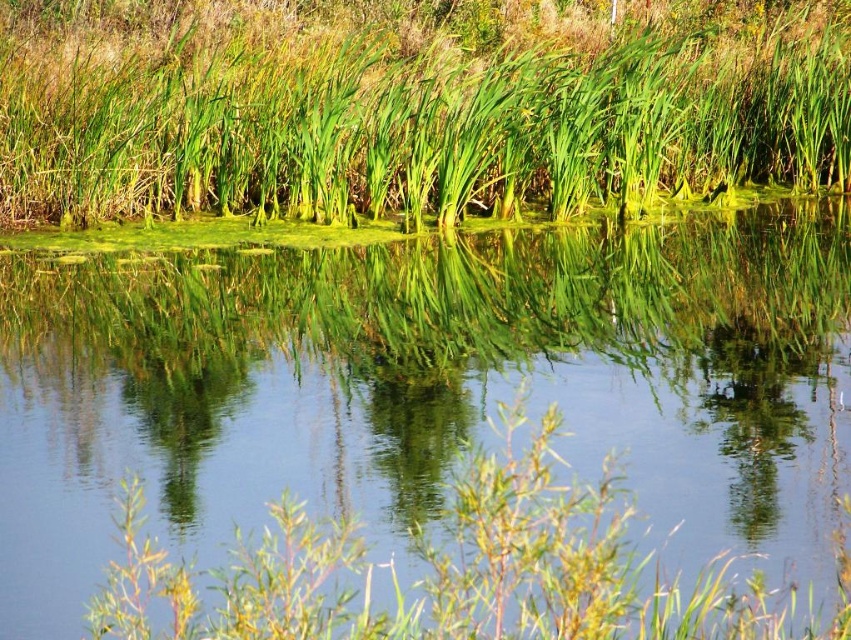
Is green grassy lake at upper center above green grass at upper center?

No, green grassy lake at upper center is not above green grass at upper center.

Which is more to the left, green grassy lake at upper center or green grass at upper center?

From the viewer's perspective, green grass at upper center appears more on the left side.

Is point (575, 346) farther from viewer compared to point (261, 147)?

No.

I want to click on green grassy lake at upper center, so click(424, 387).

Is the position of green grass at upper center less distant than that of green grass at center?

No, green grass at upper center is behind green grass at center.

Is green grass at upper center smaller than green grass at center?

Incorrect, green grass at upper center is not smaller in size than green grass at center.

Who is more distant from viewer, [832,16] or [760,422]?

Point [832,16]

Where is `green grass at upper center`? The image size is (851, 640). green grass at upper center is located at coordinates (412, 106).

Between green grassy lake at upper center and green glossy reeds at center, which one appears on the right side from the viewer's perspective?

From the viewer's perspective, green grassy lake at upper center appears more on the right side.

Is green grassy lake at upper center further to camera compared to green glossy reeds at center?

No, green grassy lake at upper center is closer to the viewer.

Does point (278, 467) come behind point (210, 428)?

No, (278, 467) is in front of (210, 428).

Where is `green grassy lake at upper center`? green grassy lake at upper center is located at coordinates (424, 387).